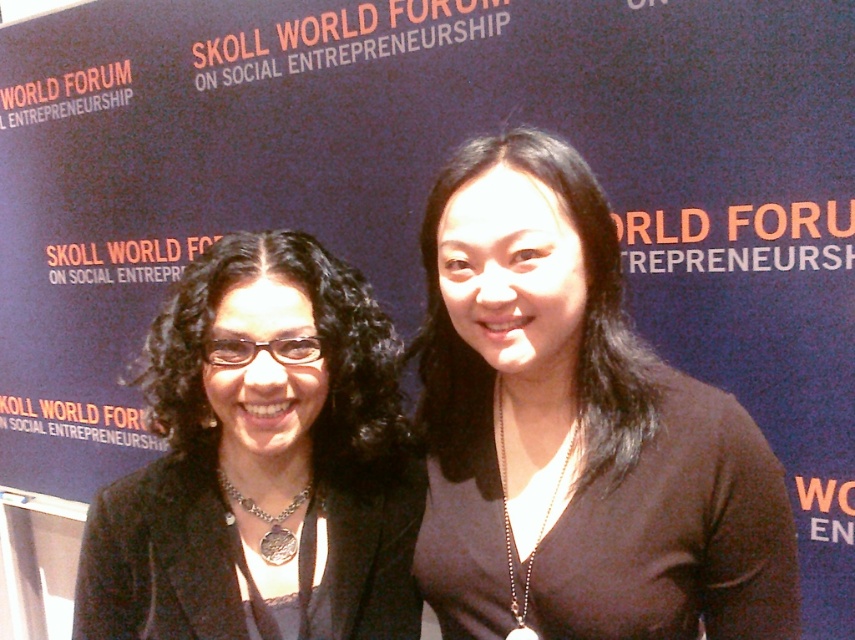
The width and height of the screenshot is (855, 640). What do you see at coordinates (576, 428) in the screenshot?
I see `black matte shirt at center` at bounding box center [576, 428].

Where is `black matte shirt at center`? The width and height of the screenshot is (855, 640). black matte shirt at center is located at coordinates (576, 428).